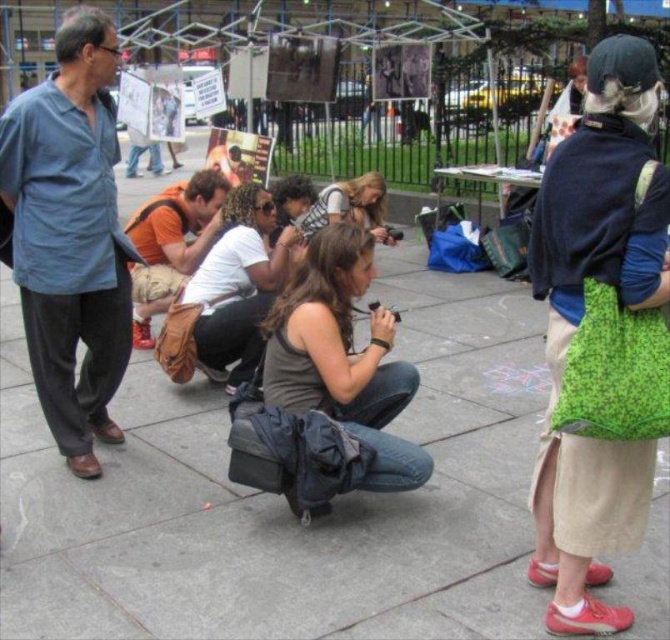
Question: Does green textured apron at center have a greater width compared to denim jeans at center?

Choices:
 (A) yes
 (B) no

Answer: (B)

Question: Which of these objects is positioned farthest from the blue cotton shirt at upper left?

Choices:
 (A) matte brown hair at center
 (B) concrete sidewalk at center
 (C) orange fabric shirt at center

Answer: (A)

Question: Which object appears closest to the camera in this image?

Choices:
 (A) concrete sidewalk at center
 (B) orange fabric shirt at center

Answer: (A)

Question: Which of these objects is positioned closest to the blue cotton shirt at upper left?

Choices:
 (A) concrete sidewalk at center
 (B) matte brown hair at center
 (C) denim jeans at center
 (D) orange fabric shirt at center

Answer: (C)

Question: Can you confirm if green textured apron at center is thinner than denim jeans at center?

Choices:
 (A) no
 (B) yes

Answer: (B)

Question: Considering the relative positions of blue cotton shirt at upper left and orange fabric shirt at center in the image provided, where is blue cotton shirt at upper left located with respect to orange fabric shirt at center?

Choices:
 (A) above
 (B) below

Answer: (B)